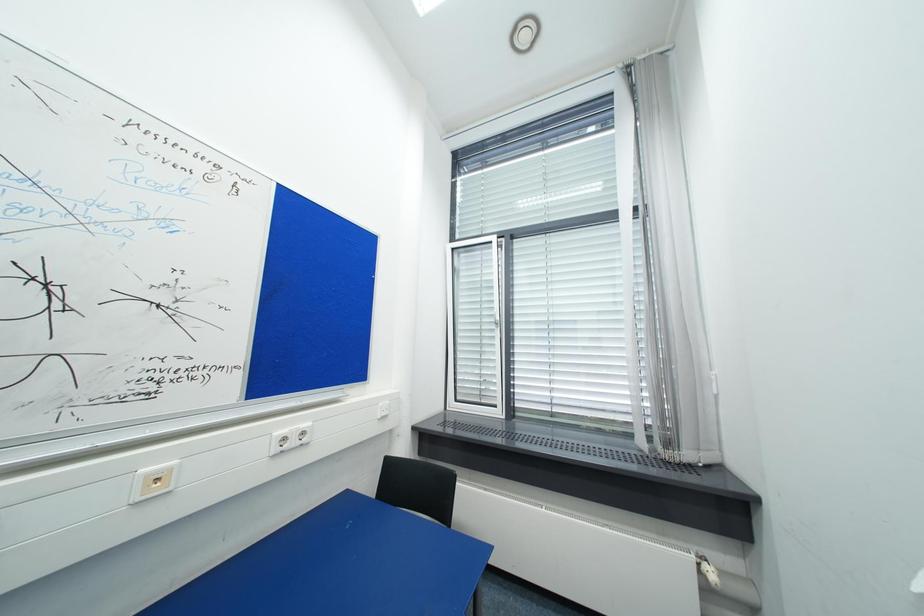
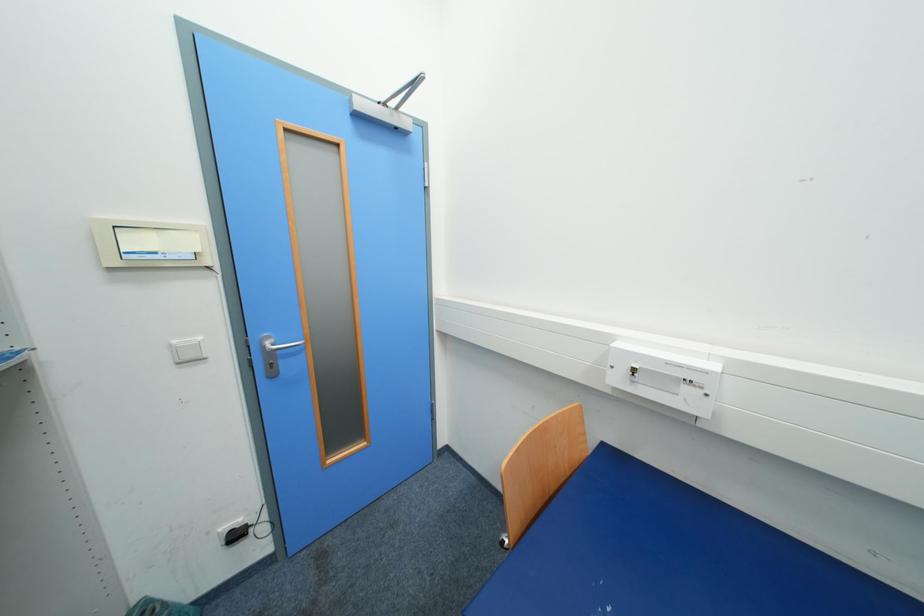
Question: How did the camera likely rotate?

Choices:
 (A) Left
 (B) Right
 (C) Up
 (D) Down

Answer: (A)